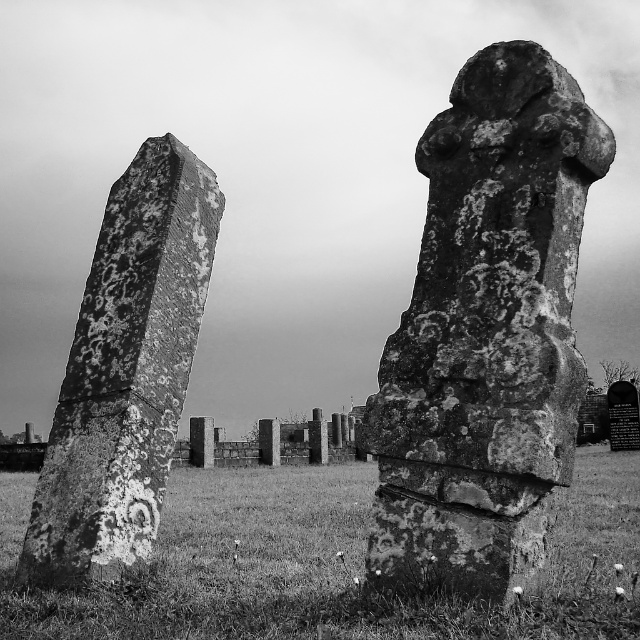
Question: Which object is the farthest from the rusty stone monument at center?

Choices:
 (A) rough stone cross at center
 (B) rusty stone gravestone at left

Answer: (B)

Question: Is rough stone cross at center above rusty stone monument at center?

Choices:
 (A) no
 (B) yes

Answer: (B)

Question: Does rough stone cross at center appear on the left side of rusty stone gravestone at left?

Choices:
 (A) yes
 (B) no

Answer: (B)

Question: Estimate the real-world distances between objects in this image. Which object is closer to the rusty stone monument at center?

Choices:
 (A) rusty stone gravestone at left
 (B) rough stone cross at center

Answer: (B)

Question: Among these points, which one is farthest from the camera?

Choices:
 (A) (310, 536)
 (B) (385, 477)

Answer: (A)

Question: Is rusty stone monument at center above rusty stone gravestone at left?

Choices:
 (A) yes
 (B) no

Answer: (B)